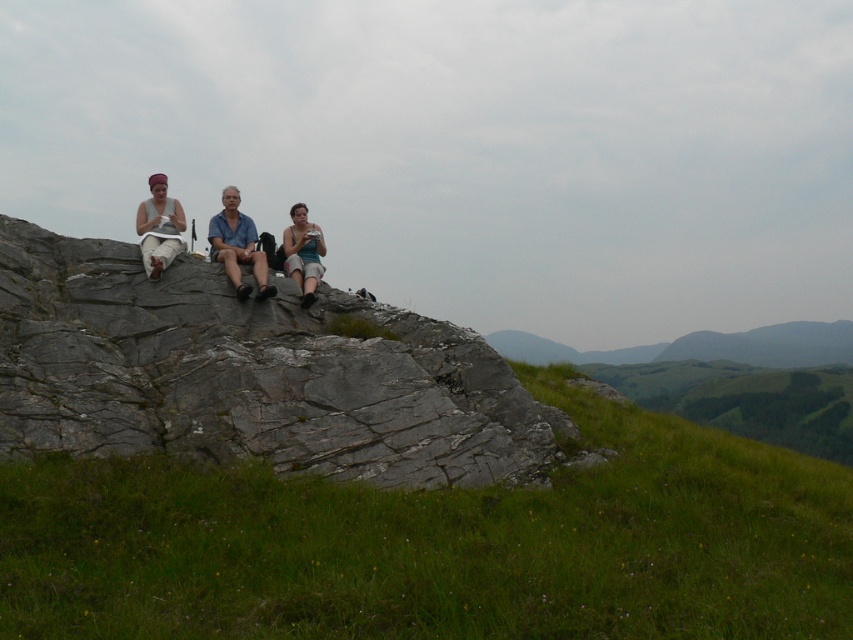
You are planning to place a small statue on the gray rough rock at center and the matte white tank top at upper left. Based on the scene description, which surface can support the statue better?

The gray rough rock at center is much taller than the matte white tank top at upper left, so it can support the statue better due to its height and stability.

You are a photographer trying to capture a photo of the blue denim shirt at center and the matte blue tank top at center. Which one would appear larger in your photo?

The blue denim shirt at center would appear larger in the photo because it is closer to the viewer than the matte blue tank top at center.